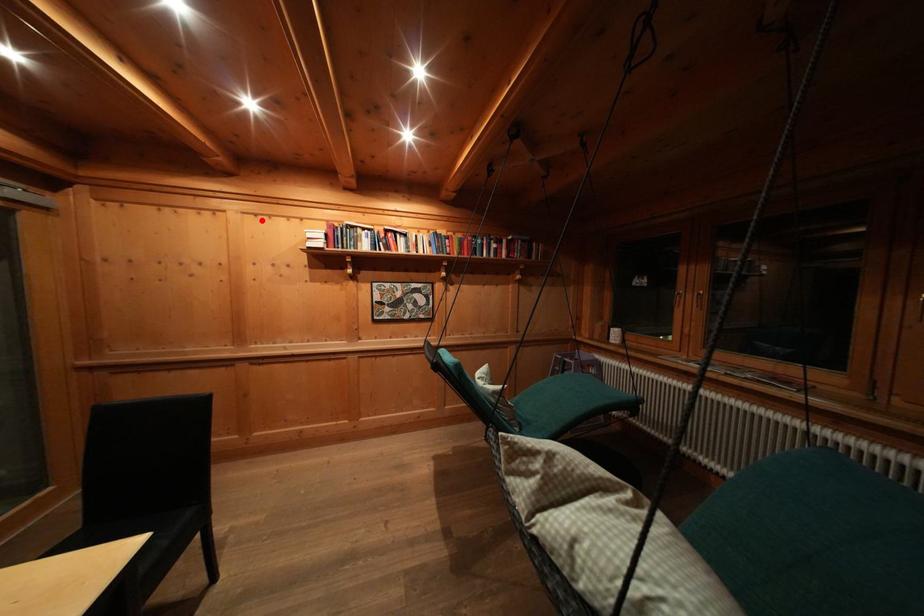
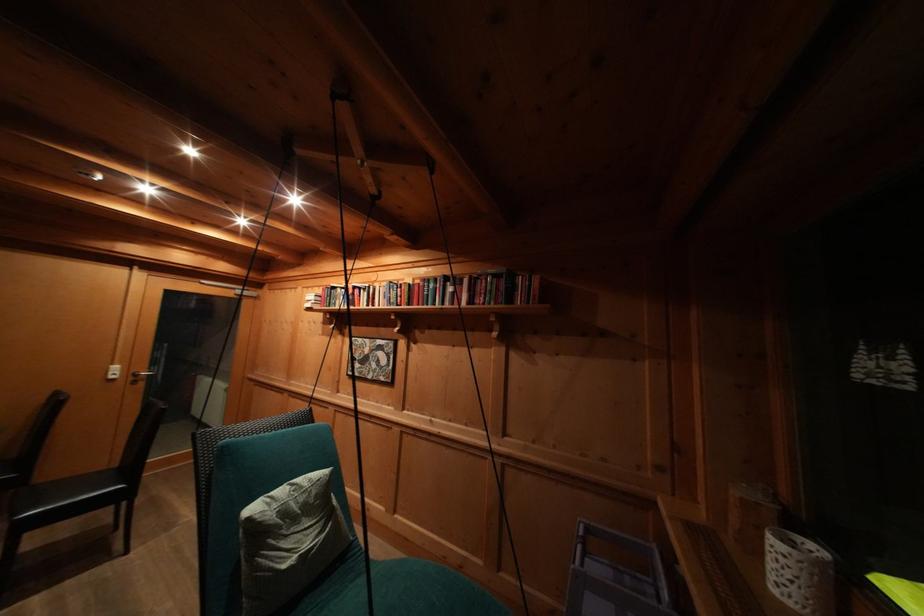
Find the pixel in the second image that matches the highlighted location in the first image.

(313, 293)